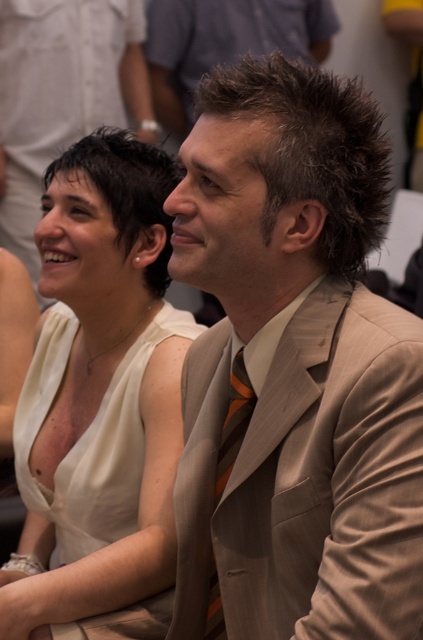
Question: Does dark brown spiky hair at upper center have a smaller size compared to orange striped tie at center?

Choices:
 (A) yes
 (B) no

Answer: (B)

Question: In this image, where is matte white dress at center located relative to orange striped tie at center?

Choices:
 (A) below
 (B) above

Answer: (B)

Question: Considering the real-world distances, which object is farthest from the matte white dress at center?

Choices:
 (A) orange striped tie at center
 (B) beige suit at center
 (C) dark brown spiky hair at upper center
 (D) tan fabric suit at center

Answer: (C)

Question: Does tan fabric suit at center appear on the right side of beige suit at center?

Choices:
 (A) no
 (B) yes

Answer: (B)

Question: Considering the real-world distances, which object is closest to the orange striped tie at center?

Choices:
 (A) beige suit at center
 (B) matte white dress at center

Answer: (B)

Question: Which point is farther to the camera?

Choices:
 (A) orange striped tie at center
 (B) matte white dress at center
 (C) beige suit at center

Answer: (C)